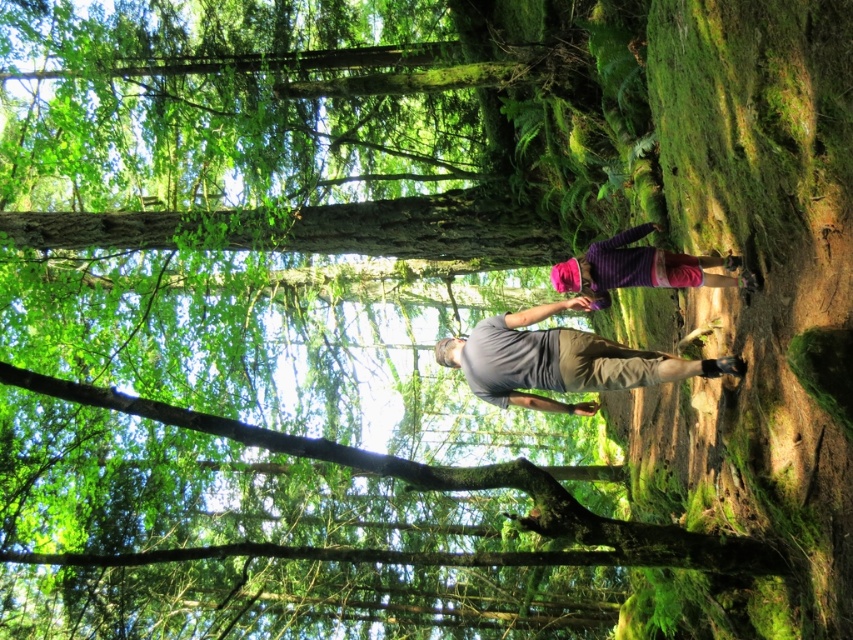
You are standing at the camera position and want to take a photo of the smooth brown tree trunk at center. If your camera has a maximum focus range of 8 meters, will you be able to capture the tree trunk clearly?

The smooth brown tree trunk at center and camera are 8.10 meters apart from each other. Since the distance exceeds the camera maximum focus range of 8 meters, you will not be able to capture the tree trunk clearly.

You are standing at point (595, 289) and want to walk to point (477, 332). Are you moving forward or backward?

Moving forward because point (477, 332) is behind point (595, 289), so walking towards it would mean moving forward.